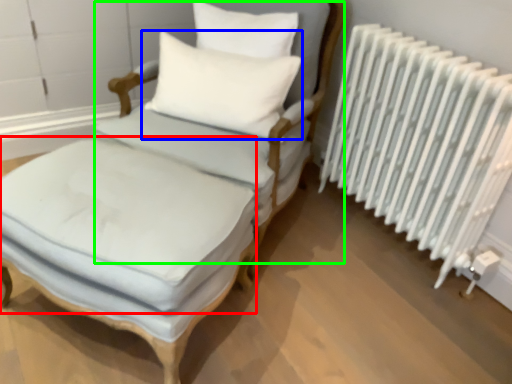
Question: Which is nearer to the mattress (highlighted by a red box)? pillow (highlighted by a blue box) or armchair (highlighted by a green box).

Choices:
 (A) pillow
 (B) armchair

Answer: (B)